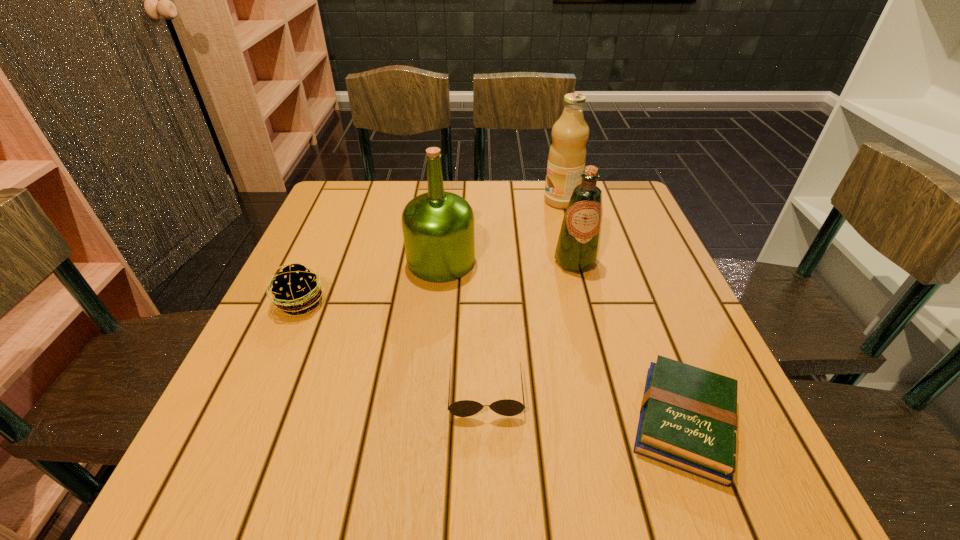
The width and height of the screenshot is (960, 540). I want to click on object present at the near right corner, so click(688, 417).

Locate an element on the screen. The height and width of the screenshot is (540, 960). vacant space at the far edge is located at coordinates coord(491,211).

This screenshot has width=960, height=540. In order to click on free location at the near edge in this screenshot , I will do `click(636, 459)`.

This screenshot has height=540, width=960. Find the location of `free region at the left edge of the desktop`. free region at the left edge of the desktop is located at coordinates (272, 319).

The width and height of the screenshot is (960, 540). Identify the location of blank space at the right edge. coord(666,348).

In the image, there is a desktop. Where is `free space at the far left corner`? free space at the far left corner is located at coordinates (x=325, y=199).

Where is `blank area at the near right corner`? This screenshot has height=540, width=960. blank area at the near right corner is located at coordinates (745, 445).

Identify the location of unoccupied area between the sunglasses and the farthest olive oil. (523, 297).

Identify the location of free space between the farthest olive oil and the leftmost olive oil. (501, 231).

The image size is (960, 540). Identify the location of free space between the farthest object and the leftmost olive oil. (501, 231).